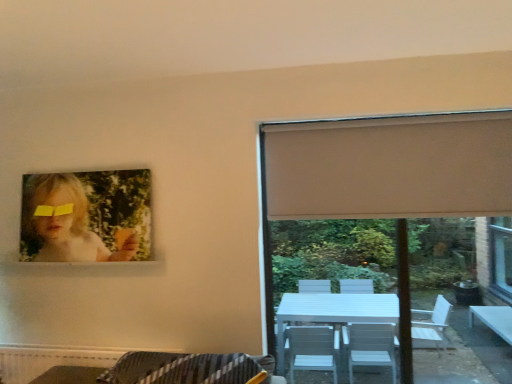
The width and height of the screenshot is (512, 384). Identify the location of beige fabric curtain at right. (391, 167).

Between beige fabric curtain at right and white matte window at upper right, which one has larger size?

white matte window at upper right.

Is beige fabric curtain at right aimed at white matte window at upper right?

No, beige fabric curtain at right is not oriented towards white matte window at upper right.

Which is in front, point (347, 150) or point (408, 320)?

The point (347, 150) is in front.

Does yellow matte glasses at upper left appear on the left side of white matte window at upper right?

Yes.

Is yellow matte glasses at upper left taller or shorter than white matte window at upper right?

Considering their sizes, yellow matte glasses at upper left has less height than white matte window at upper right.

Could you tell me if yellow matte glasses at upper left is facing white matte window at upper right?

No, yellow matte glasses at upper left is not facing towards white matte window at upper right.

Does point (57, 209) lie behind point (271, 301)?

Yes, it is.

Are white matte window at upper right and matte paper portrait at upper left making contact?

There is a gap between white matte window at upper right and matte paper portrait at upper left.

Who is more distant, white matte window at upper right or matte paper portrait at upper left?

matte paper portrait at upper left is further away from the camera.

Considering the relative positions of white matte window at upper right and matte paper portrait at upper left in the image provided, is white matte window at upper right to the left or to the right of matte paper portrait at upper left?

white matte window at upper right is positioned on matte paper portrait at upper left's right side.

From a real-world perspective, is white matte window at upper right positioned above or below beige fabric curtain at right?

white matte window at upper right is below beige fabric curtain at right.

Is white matte window at upper right taller or shorter than beige fabric curtain at right?

white matte window at upper right is taller than beige fabric curtain at right.

Can you confirm if white matte window at upper right is positioned to the right of beige fabric curtain at right?

Yes.

Is beige fabric curtain at right at the back of yellow matte glasses at upper left?

No, yellow matte glasses at upper left is not facing away from beige fabric curtain at right.

From the picture: Choose the correct answer: Is yellow matte glasses at upper left inside beige fabric curtain at right or outside it?

yellow matte glasses at upper left lies outside beige fabric curtain at right.

Considering the sizes of objects yellow matte glasses at upper left and beige fabric curtain at right in the image provided, who is thinner, yellow matte glasses at upper left or beige fabric curtain at right?

yellow matte glasses at upper left.

Who is taller, beige fabric curtain at right or matte paper portrait at upper left?

With more height is beige fabric curtain at right.

Does beige fabric curtain at right lie behind matte paper portrait at upper left?

No, beige fabric curtain at right is closer to the camera.

Could you tell me if beige fabric curtain at right is turned towards matte paper portrait at upper left?

No.

In the image, is beige fabric curtain at right on the left side or the right side of matte paper portrait at upper left?

Clearly, beige fabric curtain at right is on the right of matte paper portrait at upper left in the image.

Is matte paper portrait at upper left bigger or smaller than beige fabric curtain at right?

Considering their sizes, matte paper portrait at upper left takes up less space than beige fabric curtain at right.

Considering the points (63, 255) and (394, 134), which point is behind, point (63, 255) or point (394, 134)?

Point (63, 255)

Considering the relative positions of matte paper portrait at upper left and beige fabric curtain at right in the image provided, is matte paper portrait at upper left behind beige fabric curtain at right?

Yes, the depth of matte paper portrait at upper left is greater than that of beige fabric curtain at right.

In the scene shown: Is matte paper portrait at upper left not within beige fabric curtain at right?

Yes.

The height and width of the screenshot is (384, 512). What are the coordinates of `curtain in front of the white matte window at upper right` in the screenshot? It's located at (391, 167).

Identify the location of glasses above the white matte window at upper right (from a real-world perspective). (53, 210).

Looking at this image, based on their spatial positions, is yellow matte glasses at upper left or matte paper portrait at upper left further from beige fabric curtain at right?

yellow matte glasses at upper left.

From the image, which object appears to be farther from white matte window at upper right, beige fabric curtain at right or yellow matte glasses at upper left?

Among the two, yellow matte glasses at upper left is located further to white matte window at upper right.

Looking at the image, which one is located closer to matte paper portrait at upper left, yellow matte glasses at upper left or beige fabric curtain at right?

Among the two, yellow matte glasses at upper left is located nearer to matte paper portrait at upper left.

Which object lies nearer to the anchor point beige fabric curtain at right, matte paper portrait at upper left or yellow matte glasses at upper left?

matte paper portrait at upper left lies closer to beige fabric curtain at right than the other object.

Considering their positions, is beige fabric curtain at right positioned further to white matte window at upper right than matte paper portrait at upper left?

The object further to white matte window at upper right is matte paper portrait at upper left.

When comparing their distances from matte paper portrait at upper left, does beige fabric curtain at right or white matte window at upper right seem closer?

white matte window at upper right.

Looking at the image, which one is located further to yellow matte glasses at upper left, matte paper portrait at upper left or beige fabric curtain at right?

beige fabric curtain at right is further to yellow matte glasses at upper left.

Looking at the image, which one is located further to white matte window at upper right, yellow matte glasses at upper left or beige fabric curtain at right?

Among the two, yellow matte glasses at upper left is located further to white matte window at upper right.

Where is `curtain between matte paper portrait at upper left and white matte window at upper right in the horizontal direction`? The height and width of the screenshot is (384, 512). curtain between matte paper portrait at upper left and white matte window at upper right in the horizontal direction is located at coordinates (391, 167).

Find the location of a particular element. The image size is (512, 384). woman between yellow matte glasses at upper left and white matte window at upper right in the horizontal direction is located at coordinates (66, 223).

The width and height of the screenshot is (512, 384). Identify the location of woman located between yellow matte glasses at upper left and beige fabric curtain at right in the left-right direction. (66, 223).

Image resolution: width=512 pixels, height=384 pixels. I want to click on curtain situated between yellow matte glasses at upper left and white matte window at upper right from left to right, so click(391, 167).